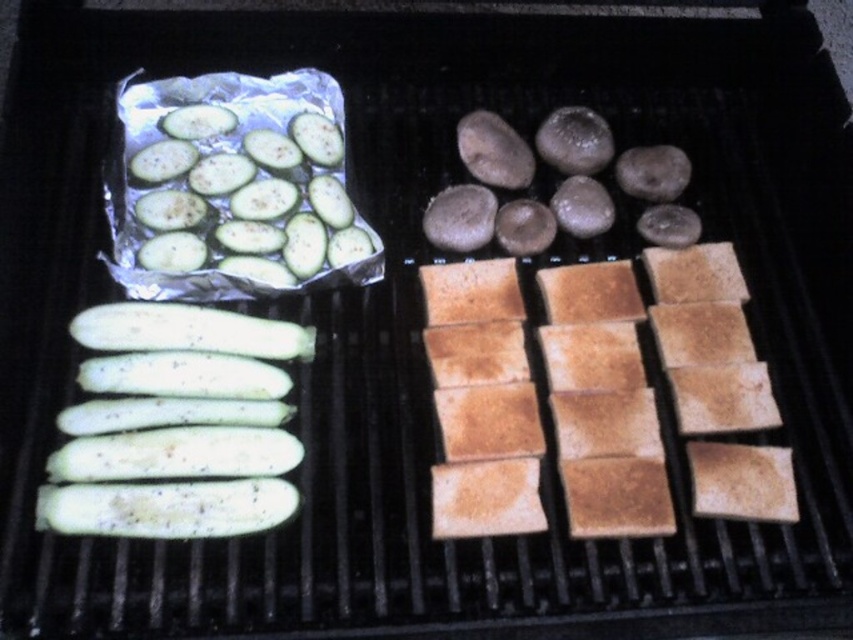
I want to click on green matte cucumber at left, so click(x=178, y=426).

Consider the image. Does green matte cucumber at left have a lesser height compared to green matte zucchini at upper left?

Yes.

You are a GUI agent. You are given a task and a screenshot of the screen. Output one action in this format:
    pyautogui.click(x=<x>, y=<y>)
    Task: Click on the green matte cucumber at left
    
    Given the screenshot: What is the action you would take?
    pyautogui.click(x=178, y=426)

Identify the location of green matte cucumber at left. (178, 426).